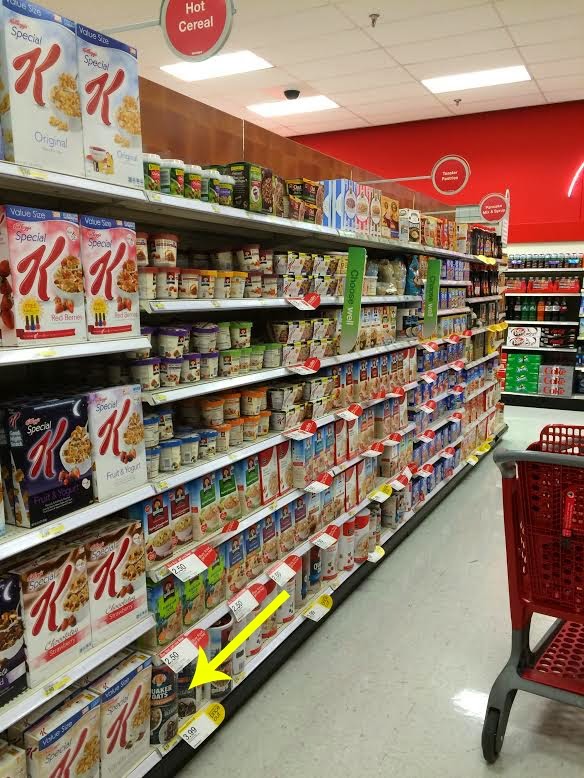
Where is `toaster`? toaster is located at coordinates (455, 170).